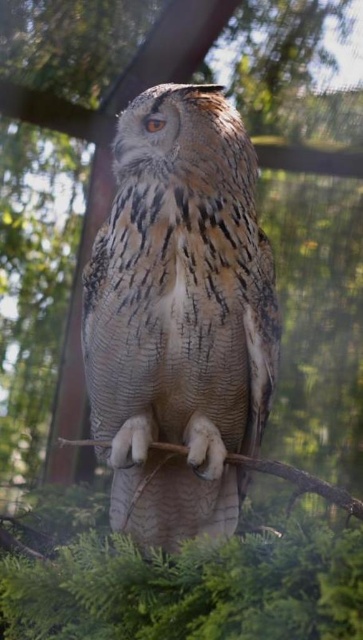
You are a photographer trying to capture a close shot of the speckled feathered owl at center and the brown textured stick at center in the image. Your camera can only focus on objects within a 30 centimeter range. Can both subjects be in focus at the same time?

The speckled feathered owl at center and the brown textured stick at center are 32.05 centimeters apart from each other. Since the camera can only focus within a 30 centimeter range, the distance between them exceeds this limit, so both subjects cannot be in focus simultaneously.

You are a photographer trying to capture a clear image of the brown textured stick at center. However, the speckled feathered owl at center is blocking your view. Can you see the stick behind the owl?

The brown textured stick at center is behind the speckled feathered owl at center, so the owl is blocking the view of the stick.

You are a photographer standing at the camera position. You want to adjust your focus to a point that is exactly 6 feet away. Is the point at point (131, 157) within your desired focus range?

The distance of point (131, 157) from the camera is 5.64 feet, which is less than 6 feet. Therefore, the point is within the desired focus range if your focus range includes distances up to 6 feet. However, if the focus is set precisely at 6 feet, it might be slightly out of focus.